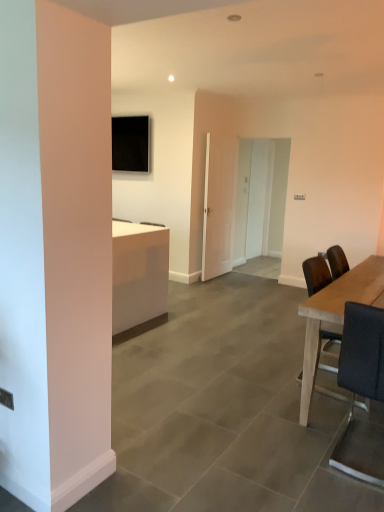
Question: From the image's perspective, is black leather chair at right above or below white glossy door at center, which is the first glass door from front to back?

Choices:
 (A) above
 (B) below

Answer: (B)

Question: From a real-world perspective, is black leather chair at right above or below white glossy door at center, which is the first glass door from front to back?

Choices:
 (A) below
 (B) above

Answer: (A)

Question: Based on their relative distances, which object is farther from the white glossy door at center, the second glass door when ordered from front to back?

Choices:
 (A) black leather chair at right
 (B) light brown wooden table at right
 (C) white glossy door at center, which is the first glass door from front to back
 (D) white glossy door at center, which ranks as the 1th glass door in back-to-front order

Answer: (A)

Question: Considering the real-world distances, which object is closest to the light brown wooden table at right?

Choices:
 (A) white glossy door at center, which ranks as the 1th glass door in back-to-front order
 (B) white glossy door at center, which is the first glass door from front to back
 (C) white glossy door at center, the second glass door when ordered from front to back
 (D) black leather chair at right

Answer: (D)